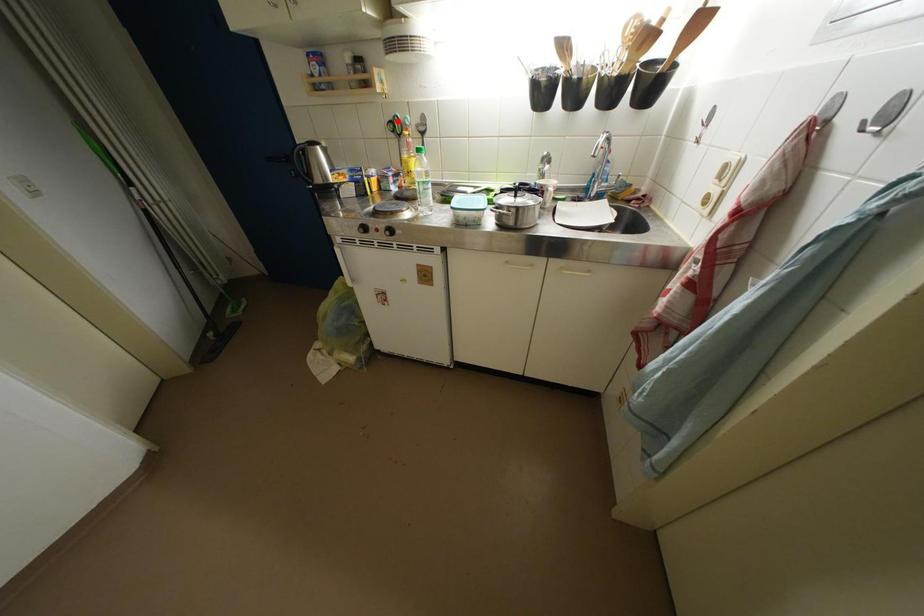
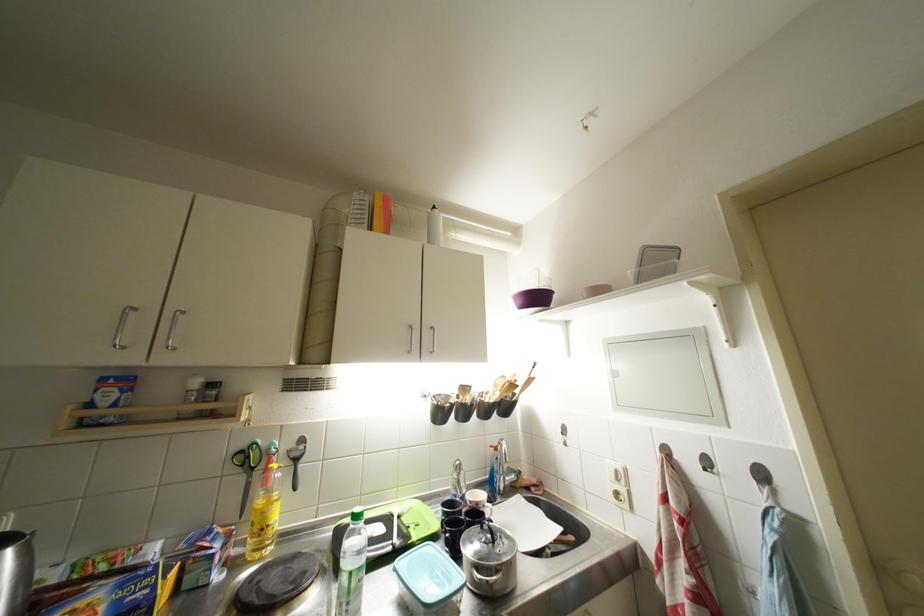
Question: I am providing you with two images of the same scene from different viewpoints. In image1, a red point is highlighted. Considering the same 3D point in image2, which of the following is correct?

Choices:
 (A) It is closer
 (B) It is farther

Answer: (B)